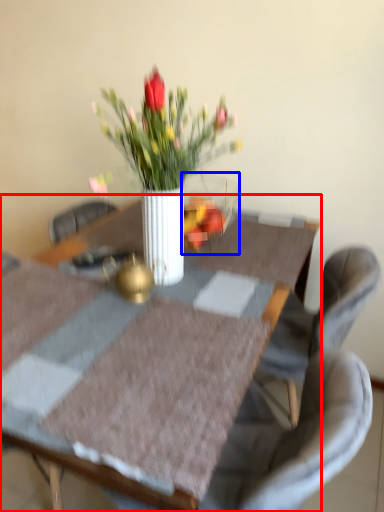
Question: Among these objects, which one is farthest to the camera, table (highlighted by a red box) or glass vase (highlighted by a blue box)?

Choices:
 (A) table
 (B) glass vase

Answer: (B)